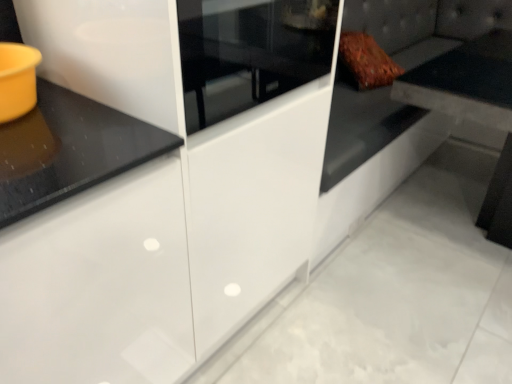
Question: Is white glossy cabinet at center facing away from matte black table at upper right?

Choices:
 (A) yes
 (B) no

Answer: (B)

Question: From a real-world perspective, is white glossy cabinet at center on matte black table at upper right?

Choices:
 (A) yes
 (B) no

Answer: (A)

Question: Can you confirm if white glossy cabinet at center is wider than matte black table at upper right?

Choices:
 (A) no
 (B) yes

Answer: (B)

Question: Is matte black table at upper right a part of white glossy cabinet at center?

Choices:
 (A) yes
 (B) no

Answer: (B)

Question: Is white glossy cabinet at center smaller than matte black table at upper right?

Choices:
 (A) yes
 (B) no

Answer: (B)

Question: Considering their positions, is matte black table at upper right located in front of or behind white glossy cabinet at center?

Choices:
 (A) front
 (B) behind

Answer: (B)

Question: Is matte black table at upper right inside or outside of white glossy cabinet at center?

Choices:
 (A) inside
 (B) outside

Answer: (B)

Question: Based on their sizes in the image, would you say matte black table at upper right is bigger or smaller than white glossy cabinet at center?

Choices:
 (A) small
 (B) big

Answer: (A)

Question: From the image's perspective, relative to white glossy cabinet at center, is matte black table at upper right above or below?

Choices:
 (A) above
 (B) below

Answer: (A)

Question: Is leather couch at right taller or shorter than matte black table at upper right?

Choices:
 (A) short
 (B) tall

Answer: (A)

Question: Considering their positions, is leather couch at right located in front of or behind matte black table at upper right?

Choices:
 (A) front
 (B) behind

Answer: (A)

Question: From the image's perspective, relative to matte black table at upper right, is leather couch at right above or below?

Choices:
 (A) above
 (B) below

Answer: (B)

Question: Considering the positions of leather couch at right and matte black table at upper right in the image, is leather couch at right wider or thinner than matte black table at upper right?

Choices:
 (A) wide
 (B) thin

Answer: (A)

Question: From the image's perspective, is leather couch at right located above or below white glossy cabinet at center?

Choices:
 (A) above
 (B) below

Answer: (A)

Question: Is leather couch at right inside the boundaries of white glossy cabinet at center, or outside?

Choices:
 (A) outside
 (B) inside

Answer: (A)